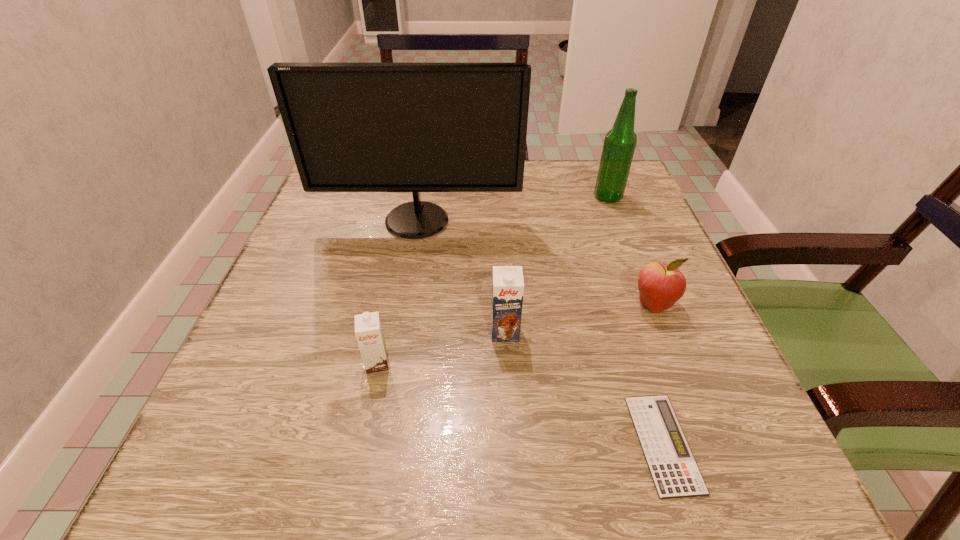
Where is `object that is at the left edge`? The height and width of the screenshot is (540, 960). object that is at the left edge is located at coordinates (352, 127).

Locate an element on the screen. Image resolution: width=960 pixels, height=540 pixels. beer bottle that is at the right edge is located at coordinates (619, 145).

Find the location of a particular element. apple positioned at the right edge is located at coordinates (660, 285).

Locate an element on the screen. calculator positioned at the right edge is located at coordinates (675, 473).

The image size is (960, 540). I want to click on object present at the far left corner, so click(352, 127).

At what (x,y) coordinates should I click in order to perform the action: click on object positioned at the far right corner. Please return your answer as a coordinate pair (x, y). The image size is (960, 540). Looking at the image, I should click on (619, 145).

Find the location of a particular element. object located at the near right corner is located at coordinates (675, 473).

I want to click on free region at the far edge of the desktop, so (558, 178).

In order to click on blank space at the left edge of the desktop in this screenshot , I will do `click(350, 240)`.

Identify the location of free space at the right edge. This screenshot has height=540, width=960. (757, 434).